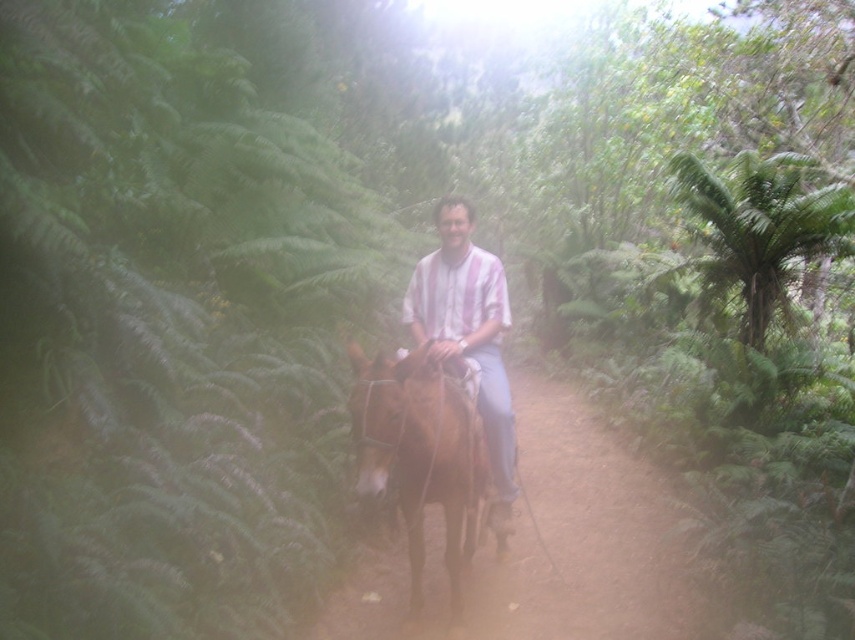
You are a photographer aiming to capture a photo of the brown glossy horse at center and the matte striped shirt at center. Based on their positions, which object should you focus on first to ensure both are in frame?

The brown glossy horse at center is below the matte striped shirt at center, so you should focus on the matte striped shirt at center first to ensure both are in frame.

You are a photographer trying to capture a clear photo of the brown glossy horse at center and the matte striped shirt at center. Since the lighting is diffused, you need to adjust your camera settings based on their sizes. Which object should you focus on first if you want to ensure both are in focus, considering their relative sizes?

The brown glossy horse at center is thinner than the matte striped shirt at center. Therefore, you should focus on the matte striped shirt at center first because larger objects require less depth of field adjustment to keep them in focus compared to thinner ones.

You are navigating a horse through the forest path and need to determine which of the two points, point (x=423, y=369) or point (x=433, y=320), is closer to you. Which point should you aim for if you want to reach the nearest one first?

You should aim for point (x=423, y=369) because it is closer to the camera than point (x=433, y=320), meaning it is nearer to your current position.